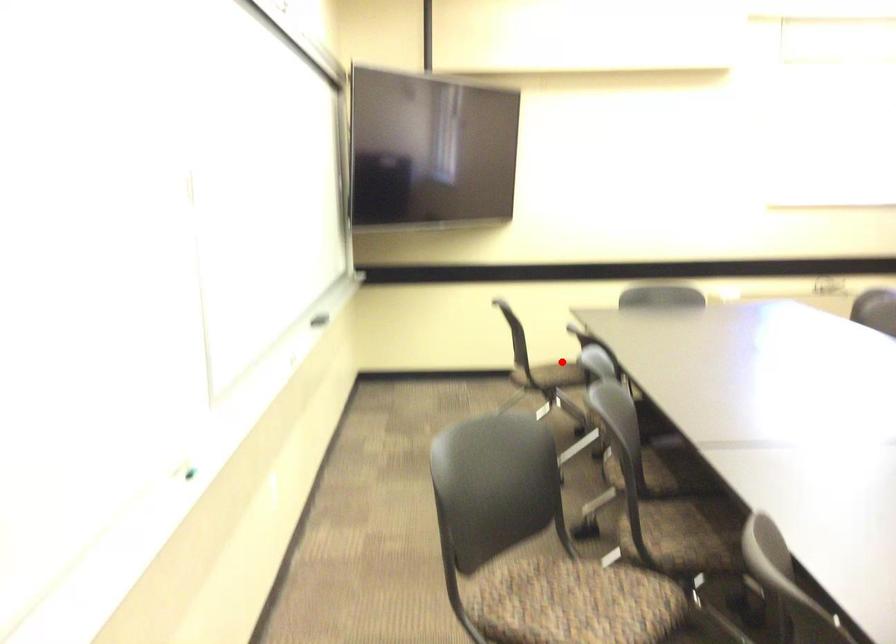
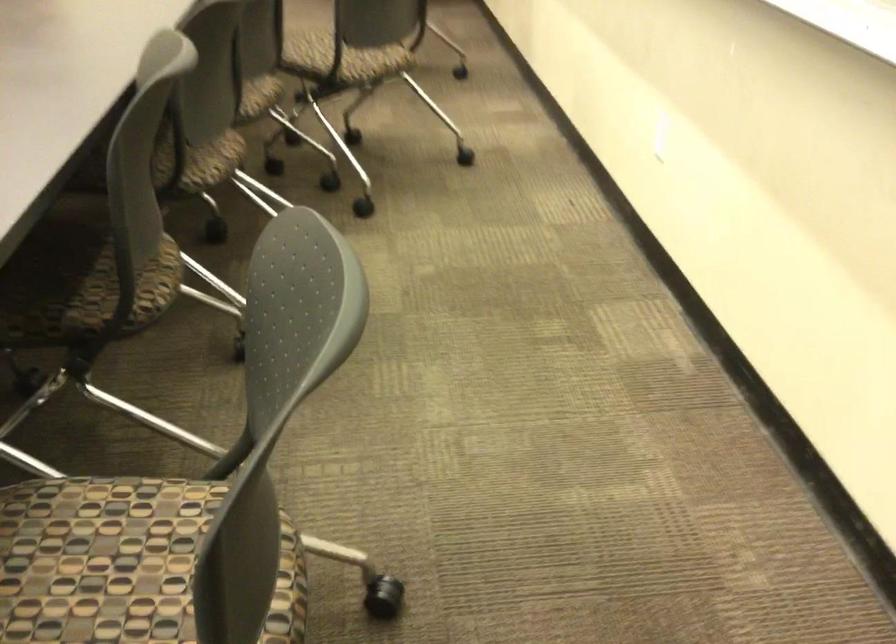
Question: A red point is marked in image1. In image2, is the corresponding 3D point closer to the camera or farther? Reply with the corresponding letter.

Choices:
 (A) The corresponding 3D point is closer.
 (B) The corresponding 3D point is farther.

Answer: (A)